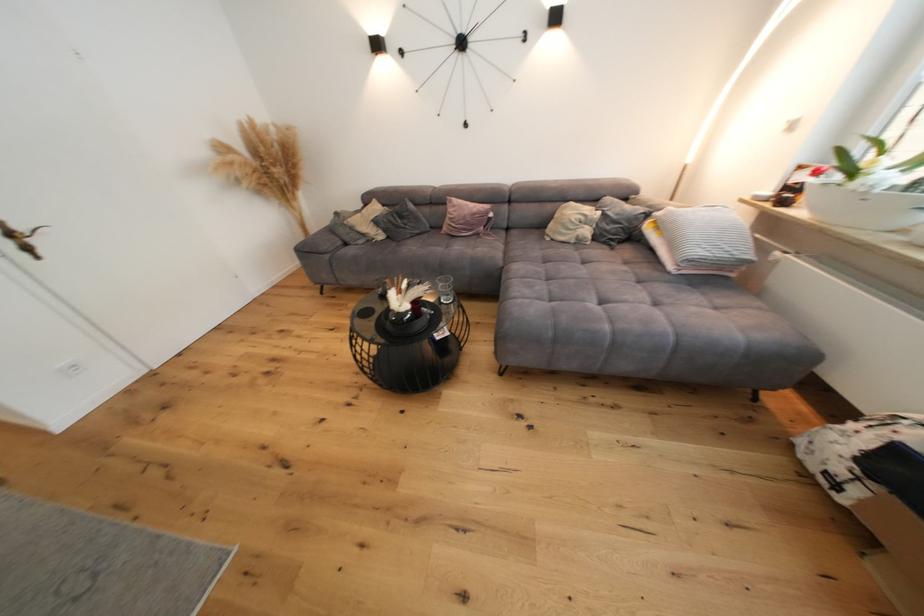
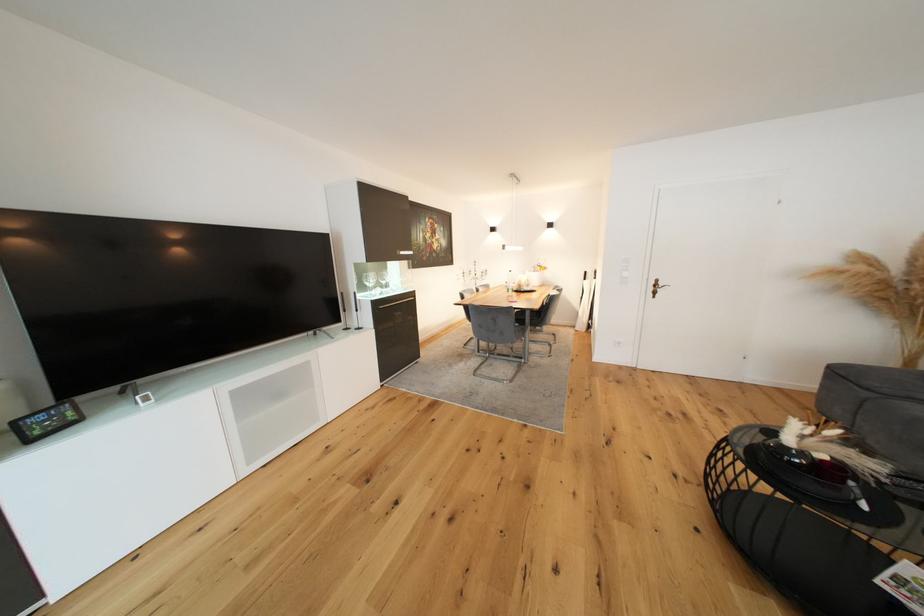
In the second image, find the point that corresponds to point 333,254 in the first image.

(874, 391)